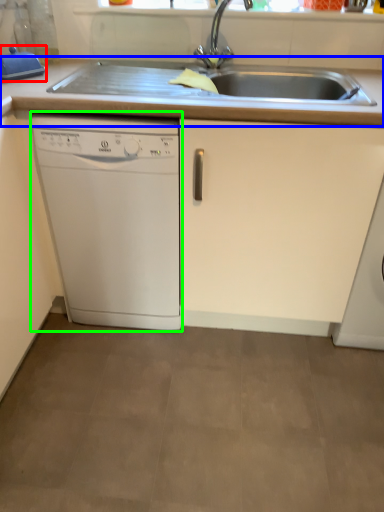
Question: Which object is the closest to the appliance (highlighted by a red box)? Choose among these: countertop (highlighted by a blue box) or home appliance (highlighted by a green box).

Choices:
 (A) countertop
 (B) home appliance

Answer: (A)